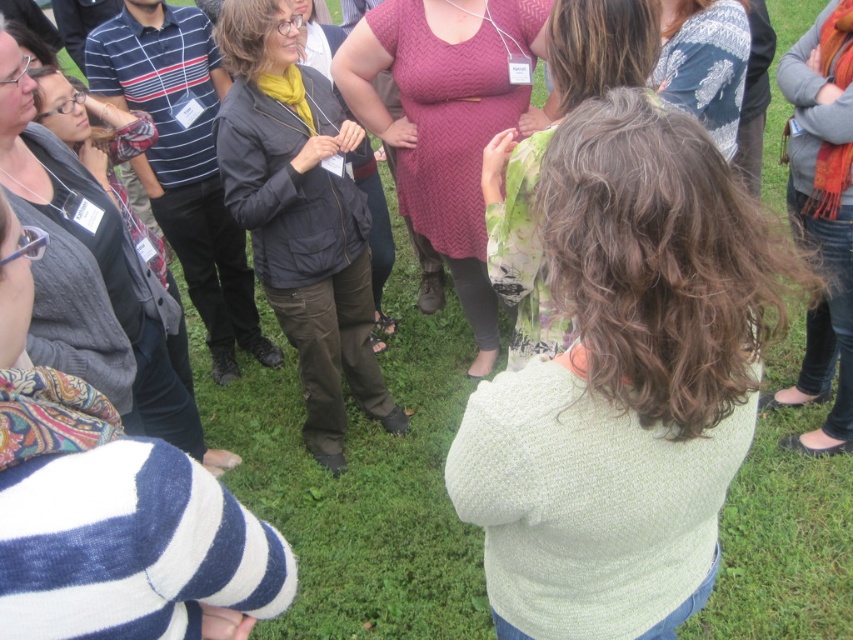
Question: Is light green sweater at center thinner than knitted gray sweater at left?

Choices:
 (A) no
 (B) yes

Answer: (A)

Question: Which of the following is the closest to the observer?

Choices:
 (A) matte black jacket at center
 (B) herringbone knit sweater at center
 (C) green floral dress at center

Answer: (C)

Question: Can you confirm if herringbone knit sweater at center is smaller than knitted sweater at upper right?

Choices:
 (A) yes
 (B) no

Answer: (B)

Question: Which object is positioned closest to the knitted sweater at upper right?

Choices:
 (A) green floral dress at center
 (B) knitted gray sweater at left
 (C) herringbone knit sweater at center
 (D) light green sweater at center

Answer: (A)

Question: In this image, where is herringbone knit sweater at center located relative to knitted sweater at upper right?

Choices:
 (A) left
 (B) right

Answer: (A)

Question: Which of the following is the farthest from the observer?

Choices:
 (A) (529, 145)
 (B) (624, 456)
 (C) (833, 336)

Answer: (C)